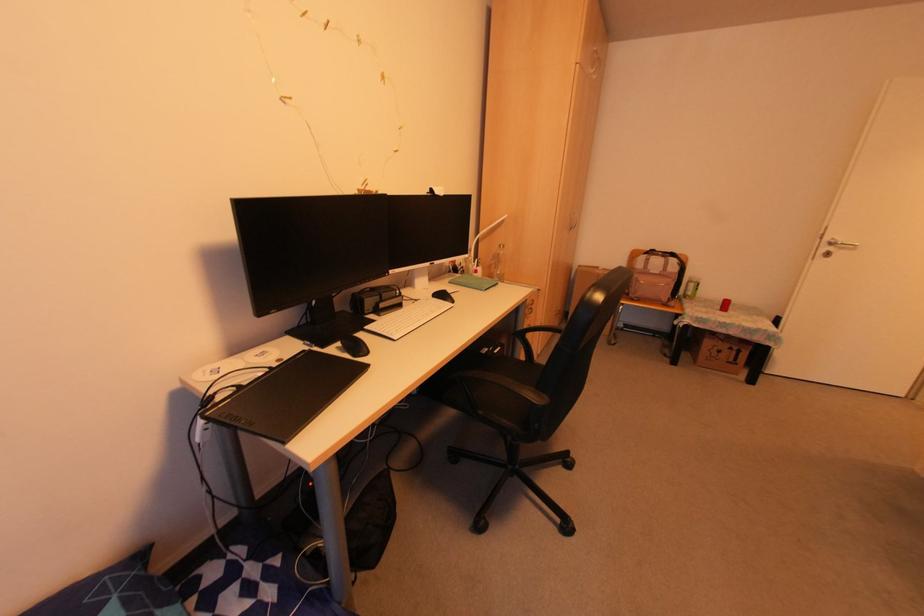
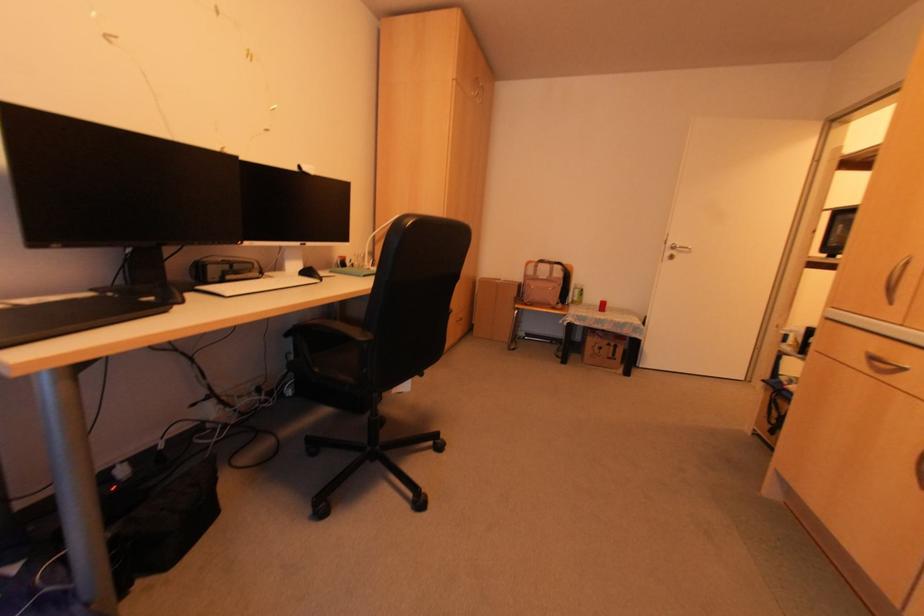
Where in the second image is the point corresponding to (x=655, y=273) from the first image?

(542, 278)